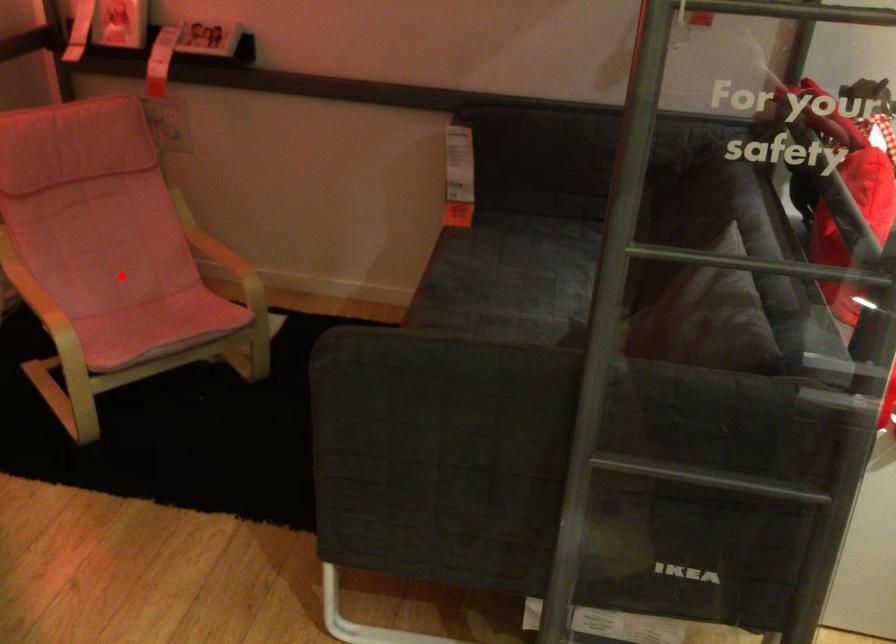
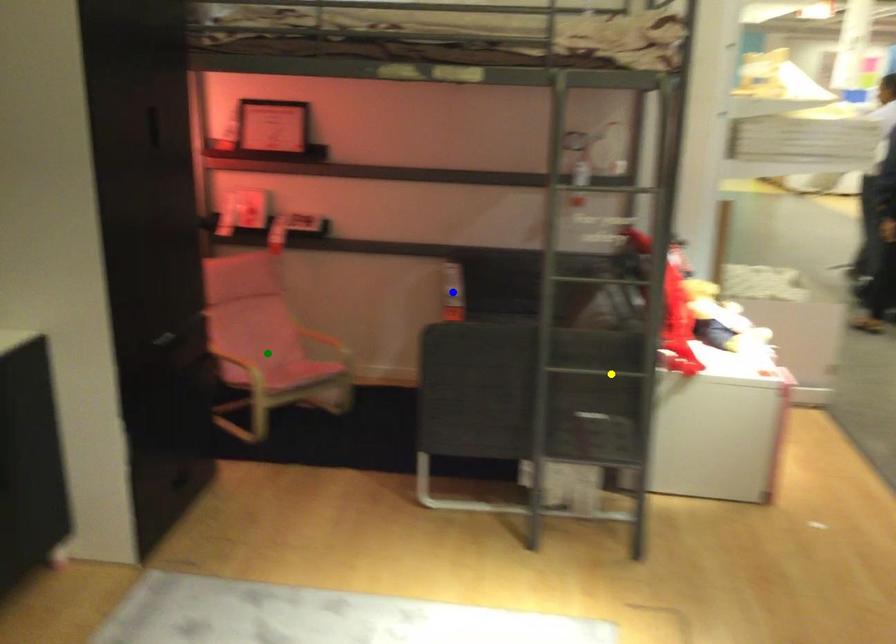
Question: I am providing you with two images of the same scene from different viewpoints. A red point is marked on the first image. You are given multiple points on the second image. Which spot in image 2 lines up with the point in image 1?

Choices:
 (A) green point
 (B) blue point
 (C) yellow point

Answer: (A)